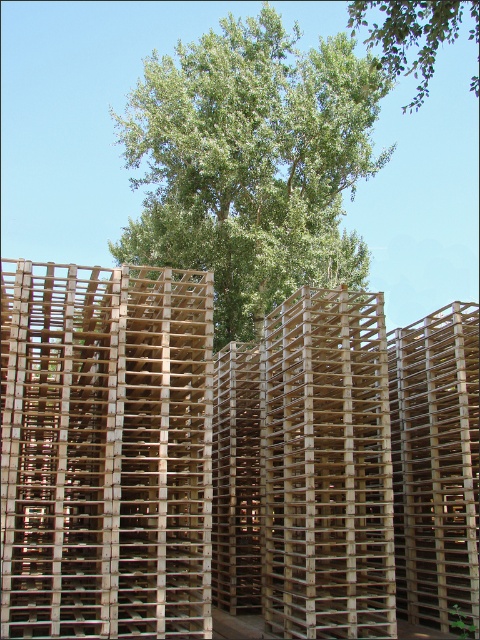
Who is positioned more to the right, natural wood pallets at center or green leafy tree at upper center?

From the viewer's perspective, green leafy tree at upper center appears more on the right side.

Does natural wood pallets at center have a lesser height compared to green leafy tree at upper center?

Yes.

You are a GUI agent. You are given a task and a screenshot of the screen. Output one action in this format:
    pyautogui.click(x=<x>, y=<y>)
    Task: Click on the natural wood pallets at center
    
    Given the screenshot: What is the action you would take?
    pyautogui.click(x=230, y=460)

Where is `natural wood pallets at center`? The height and width of the screenshot is (640, 480). natural wood pallets at center is located at coordinates (230, 460).

Can you confirm if green leafy tree at center is wider than green leafy tree at upper center?

Indeed, green leafy tree at center has a greater width compared to green leafy tree at upper center.

Is point (257, 106) less distant than point (430, 22)?

No, it is behind (430, 22).

Locate an element on the screen. green leafy tree at center is located at coordinates (252, 163).

Can you confirm if natural wood pallets at center is positioned above green leafy tree at center?

No, natural wood pallets at center is not above green leafy tree at center.

Which is in front, point (51, 388) or point (263, 225)?

Point (51, 388) is in front.

Is point (44, 602) more distant than point (314, 102)?

That is False.

This screenshot has height=640, width=480. I want to click on natural wood pallets at center, so click(230, 460).